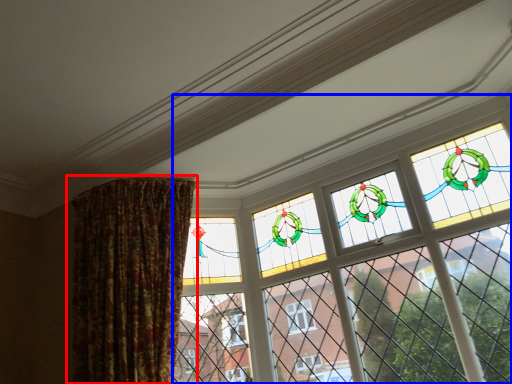
Question: Which of the following is the closest to the observer, curtain (highlighted by a red box) or window (highlighted by a blue box)?

Choices:
 (A) curtain
 (B) window

Answer: (B)